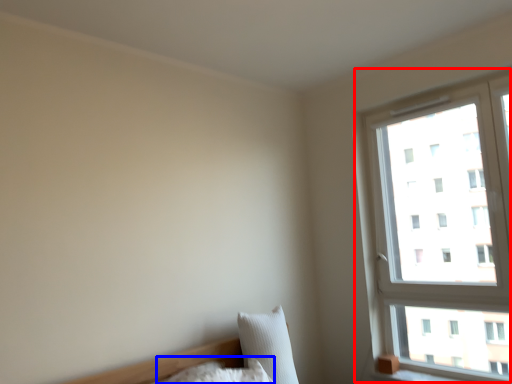
Question: Which object appears closest to the camera in this image, window (highlighted by a red box) or pillow (highlighted by a blue box)?

Choices:
 (A) window
 (B) pillow

Answer: (B)